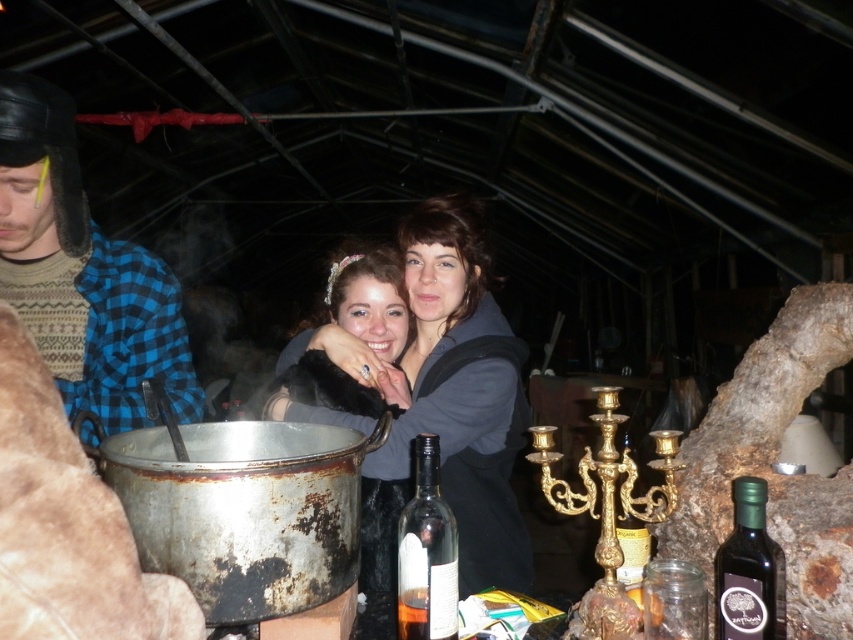
Who is more forward, (376, 333) or (749, 529)?

Point (749, 529) is in front.

Does matte black fur coat at center come in front of green glass bottle at right?

That is False.

What do you see at coordinates (369, 300) in the screenshot? I see `matte black fur coat at center` at bounding box center [369, 300].

Image resolution: width=853 pixels, height=640 pixels. Identify the location of matte black fur coat at center. (369, 300).

Does blue plaid shirt at left appear on the left side of clear glass bottle at lower center?

Yes, blue plaid shirt at left is to the left of clear glass bottle at lower center.

Locate an element on the screen. blue plaid shirt at left is located at coordinates (83, 273).

Locate an element on the screen. The image size is (853, 640). blue plaid shirt at left is located at coordinates (83, 273).

Does dark gray hoodie at center come behind matte black fur coat at center?

That is True.

Is point (366, 420) farther from camera compared to point (398, 355)?

That is False.

The image size is (853, 640). Find the location of `dark gray hoodie at center`. dark gray hoodie at center is located at coordinates (444, 401).